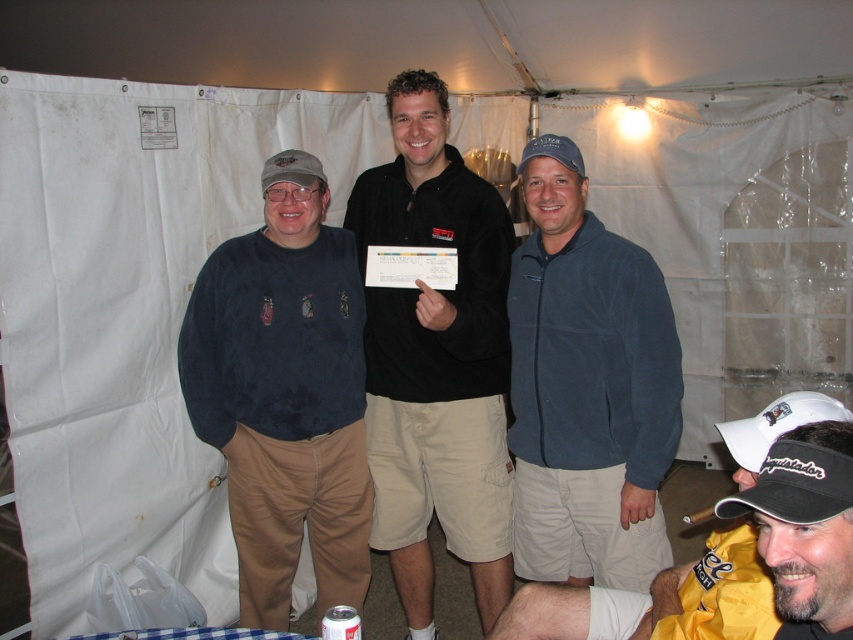
You are a photographer setting up for a group photo. You need to position the dark blue fleece at center and the black cap at lower right so that they are exactly 1.2 meters apart. Currently, they are 1.44 meters apart. Which object should you move closer to achieve the desired distance?

The dark blue fleece at center and the black cap at lower right are currently 1.44 meters apart. To reduce the distance to 1.2 meters, you need to move either one closer. Since the question doesn not specify which object to move, the photographer can choose to move either the dark blue fleece at center toward the black cap at lower right or the black cap at lower right toward the dark blue fleece at center by 0.24 meters.

You are a photographer setting up for a group photo. You notice the black fleece jacket at center and the black cap at lower right. Which object should you adjust to ensure both are fully visible in the frame?

The black fleece jacket at center is above the black cap at lower right. To ensure both are fully visible, adjust the black cap at lower right to move it closer to the jacket or lower the jacket slightly.

You are standing in front of the white tent structure. You see a point at coordinates (436,360). Which object is this point located on?

The point at coordinates (436,360) is located on the black fleece jacket at center.